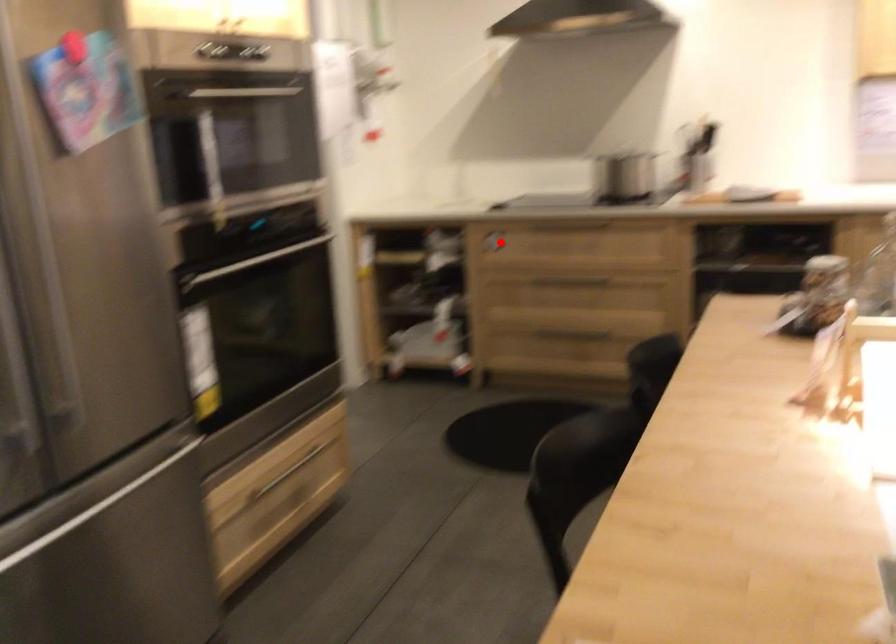
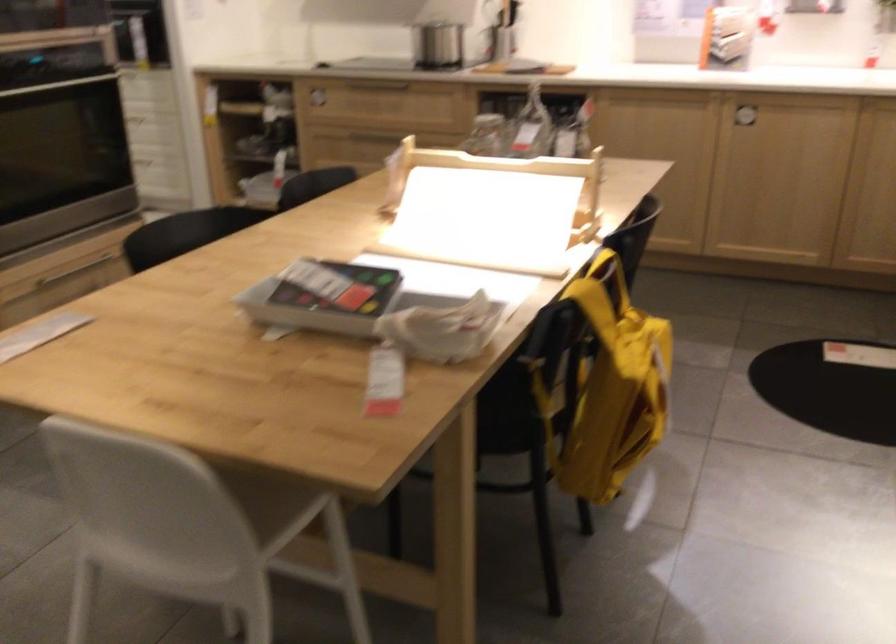
In the second image, find the point that corresponds to the highlighted location in the first image.

(316, 100)